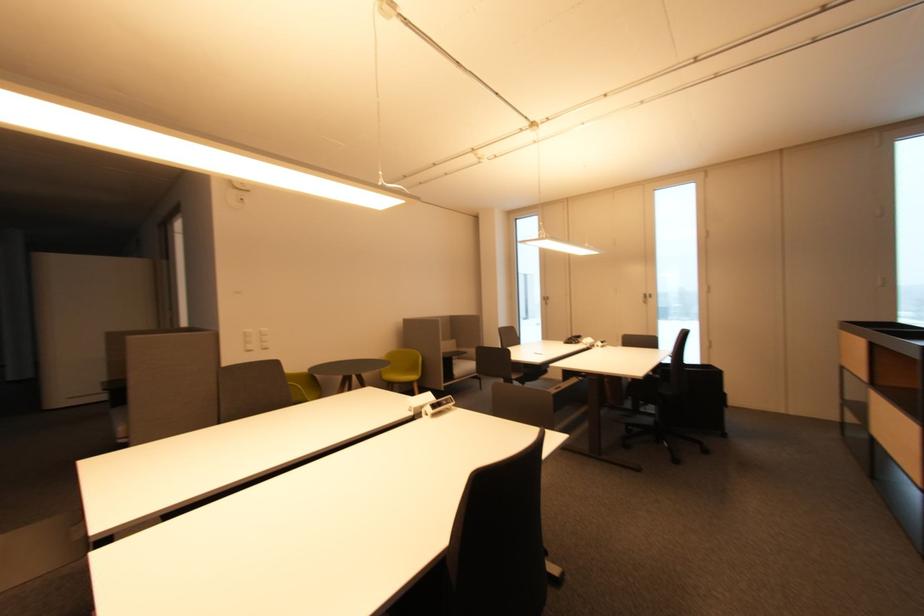
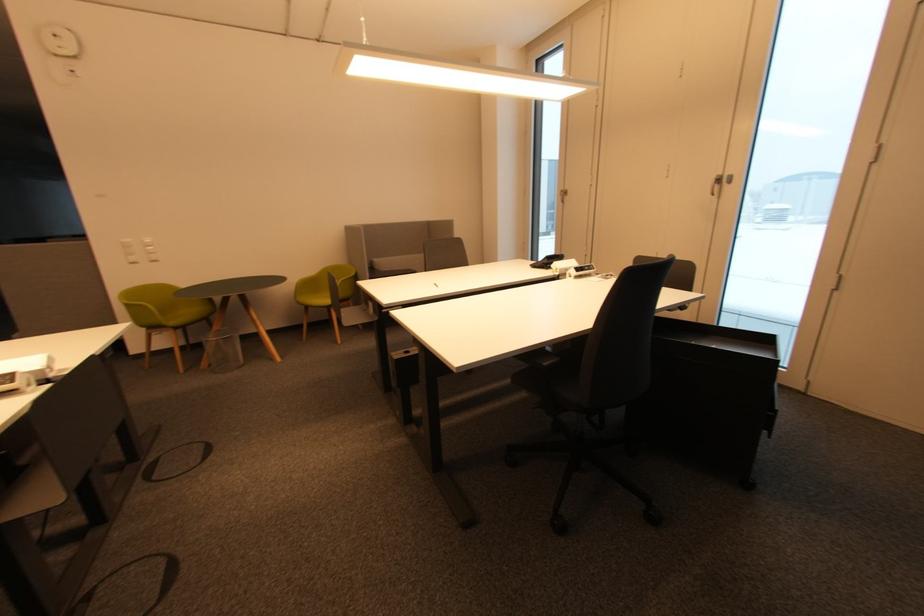
In a continuous first-person perspective shot, in which direction is the camera moving?

The cameraman moved toward right, forward.